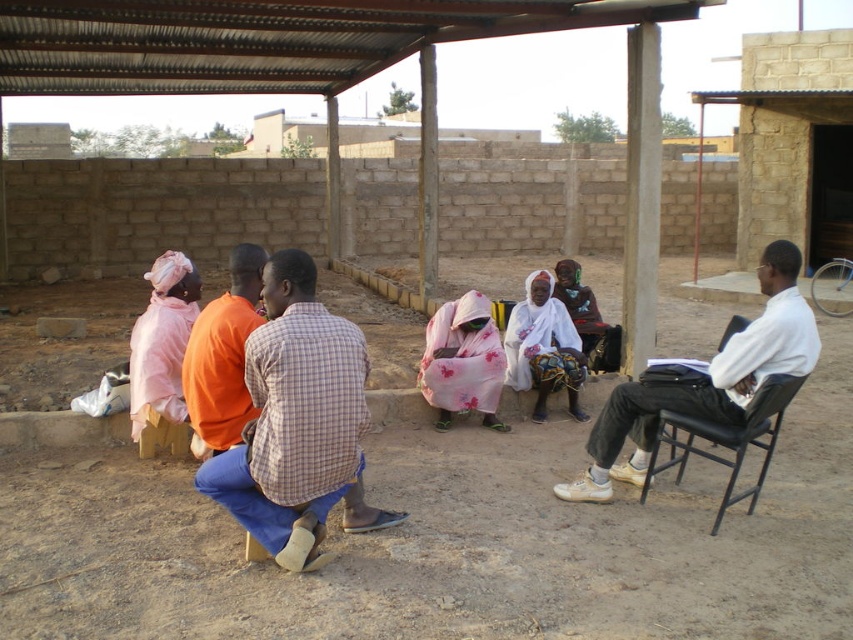
You are standing at the point labeled as point (212, 314) and want to walk towards the point labeled as point (321, 419). Which direction should you face to move directly towards your destination?

You should face forward because point (321, 419) is in front of point (212, 314).

You are standing in the outdoor area and want to move from the checkered fabric shirt at center to the black leather chair at right. Which direction should you move to reach the chair?

The checkered fabric shirt at center is to the left of the black leather chair at right, so you should move to the right to reach the chair.

You are standing at the back of the scene and want to see the checkered fabric shirt at center. Is there any obstruction between you and the black leather chair at right?

The checkered fabric shirt at center is above the black leather chair at right, so there is no obstruction between you and the black leather chair at right because the shirt is positioned above it.